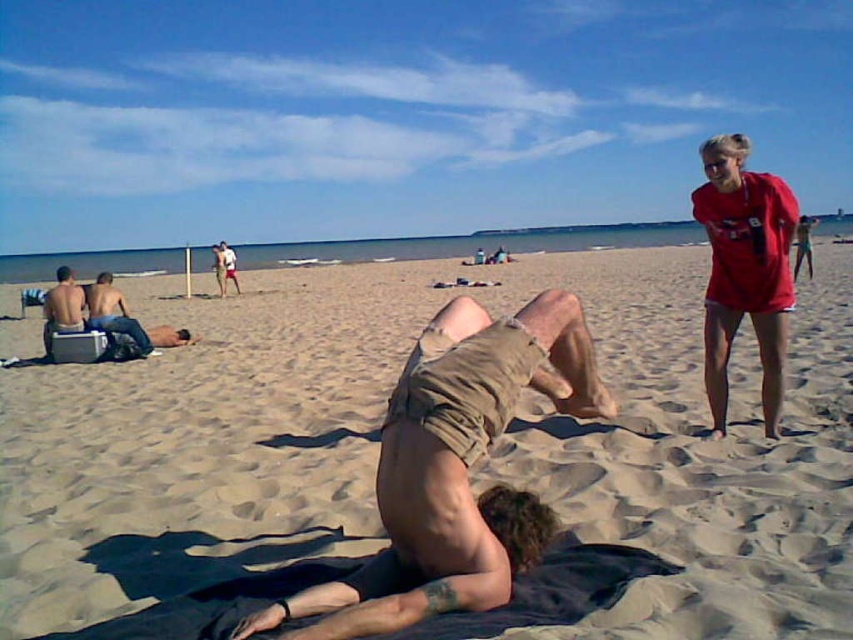
You are a photographer standing at the edge of the beach. You want to capture a photo that includes both the smooth tan skin at center and the matte khaki shorts at left. Given that your camera has a maximum focus range of 8 meters, will you be able to include both subjects in the frame without moving closer?

The distance between the smooth tan skin at center and the matte khaki shorts at left is 7.98 meters, which is within the camera maximum focus range of 8 meters. Therefore, you can capture both subjects in the frame without moving closer.

You are a photographer positioned at the center of the beach scene. You want to capture a photo that includes both the smooth tan skin at center and the light brown skin at center. Given that your camera has a maximum focus range of 15 meters, will both subjects be in focus?

The smooth tan skin at center and light brown skin at center are 16.30 meters apart. Since the maximum focus range is 15 meters, the distance between them exceeds this limit. Therefore, both subjects cannot be in focus simultaneously.